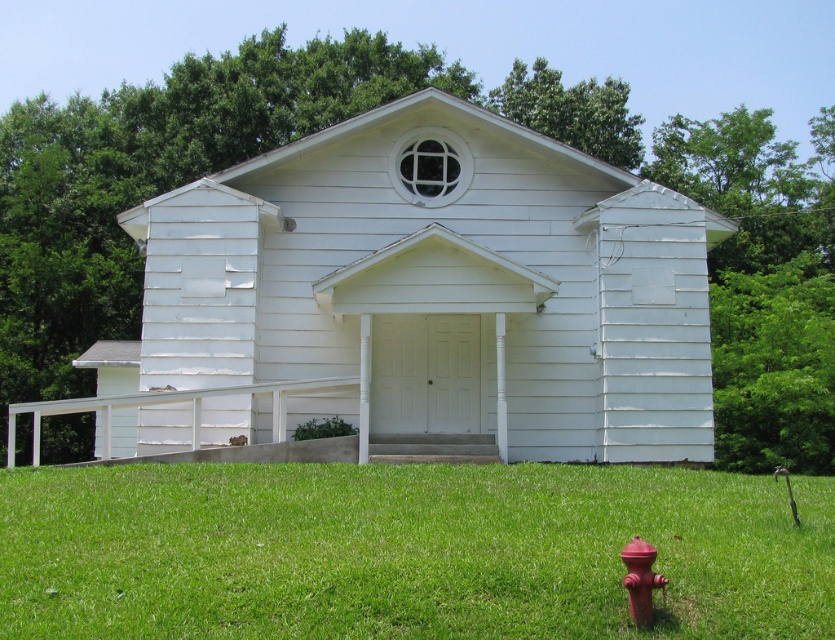
Question: Does green grass at lower center have a smaller size compared to red matte fire hydrant at lower right?

Choices:
 (A) yes
 (B) no

Answer: (B)

Question: Which is farther from the red matte fire hydrant at lower right?

Choices:
 (A) white wood church at center
 (B) green grass at lower center

Answer: (A)

Question: Which is nearer to the green grass at lower center?

Choices:
 (A) white wood church at center
 (B) red matte fire hydrant at lower right

Answer: (B)

Question: Can you confirm if green grass at lower center is smaller than red matte fire hydrant at lower right?

Choices:
 (A) no
 (B) yes

Answer: (A)

Question: Which of the following is the farthest from the observer?

Choices:
 (A) (515, 196)
 (B) (641, 609)

Answer: (A)

Question: Can you confirm if white wood church at center is bigger than green grass at lower center?

Choices:
 (A) no
 (B) yes

Answer: (B)